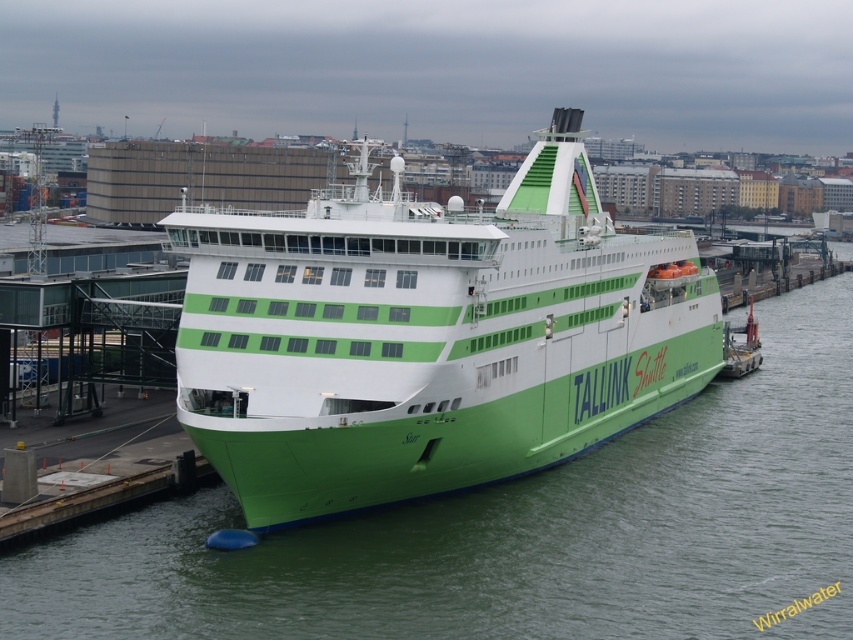
Question: In this image, where is green matte ship at center located relative to green matte water at center?

Choices:
 (A) below
 (B) above

Answer: (B)

Question: In this image, where is green matte ship at center located relative to green matte water at center?

Choices:
 (A) below
 (B) above

Answer: (B)

Question: Is green matte ship at center thinner than green matte water at center?

Choices:
 (A) yes
 (B) no

Answer: (A)

Question: Which point is closer to the camera?

Choices:
 (A) (68, 609)
 (B) (483, 304)

Answer: (A)

Question: Which object appears farthest from the camera in this image?

Choices:
 (A) green matte ship at center
 (B) green matte water at center

Answer: (A)

Question: Which of the following is the farthest from the observer?

Choices:
 (A) green matte ship at center
 (B) green matte water at center

Answer: (A)